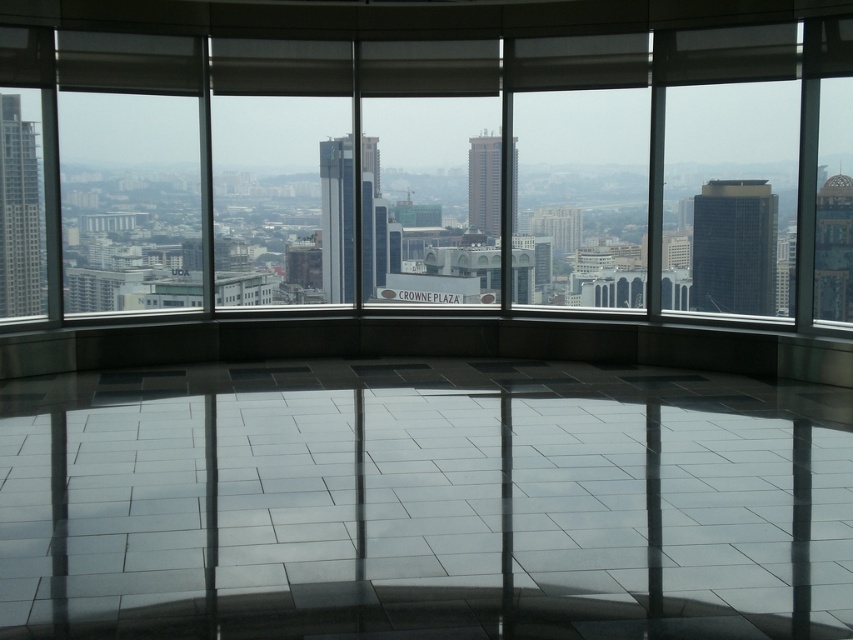
Question: Observing the image, what is the correct spatial positioning of black glass tower at right in reference to glassy reflective skyscraper at center?

Choices:
 (A) above
 (B) below

Answer: (B)

Question: Among these objects, which one is nearest to the camera?

Choices:
 (A) black glass tower at right
 (B) glassy reflective skyscraper at center

Answer: (B)

Question: Estimate the real-world distances between objects in this image. Which object is farther from the black glass tower at right?

Choices:
 (A) glassy reflective skyscraper at center
 (B) matte glass skyscraper at left

Answer: (B)

Question: Among these points, which one is farthest from the camera?

Choices:
 (A) (758, 312)
 (B) (26, 173)

Answer: (A)

Question: Does black glass tower at right come behind matte glass tower at center?

Choices:
 (A) no
 (B) yes

Answer: (B)

Question: Can you confirm if black glass tower at right is thinner than glassy reflective skyscraper at center?

Choices:
 (A) no
 (B) yes

Answer: (A)